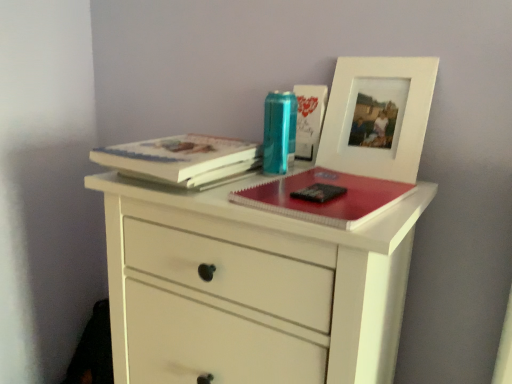
Question: Are hardcover book at upper left, which is the 1th paperback book from left to right, and white matte picture frame at upper right beside each other?

Choices:
 (A) no
 (B) yes

Answer: (A)

Question: Is hardcover book at upper left, which is the 1th paperback book from left to right, oriented away from white matte picture frame at upper right?

Choices:
 (A) yes
 (B) no

Answer: (B)

Question: Considering the relative sizes of hardcover book at upper left, marked as the 2th paperback book in a right-to-left arrangement, and white matte picture frame at upper right in the image provided, is hardcover book at upper left, marked as the 2th paperback book in a right-to-left arrangement, wider than white matte picture frame at upper right?

Choices:
 (A) yes
 (B) no

Answer: (A)

Question: Can you confirm if hardcover book at upper left, which is the 1th paperback book from left to right, is thinner than white matte picture frame at upper right?

Choices:
 (A) yes
 (B) no

Answer: (B)

Question: From the image's perspective, is hardcover book at upper left, marked as the 2th paperback book in a right-to-left arrangement, located beneath white matte picture frame at upper right?

Choices:
 (A) yes
 (B) no

Answer: (A)

Question: Looking at the image, does matte red notebook at center seem bigger or smaller compared to translucent plastic can at center?

Choices:
 (A) big
 (B) small

Answer: (A)

Question: Is point (349, 213) closer or farther from the camera than point (288, 158)?

Choices:
 (A) closer
 (B) farther

Answer: (A)

Question: Considering their positions, is matte red notebook at center located in front of or behind translucent plastic can at center?

Choices:
 (A) front
 (B) behind

Answer: (A)

Question: Is matte red notebook at center inside or outside of translucent plastic can at center?

Choices:
 (A) inside
 (B) outside

Answer: (B)

Question: From a real-world perspective, is translucent plastic can at center physically located above or below white matte picture frame at upper right?

Choices:
 (A) below
 (B) above

Answer: (A)

Question: Choose the correct answer: Is translucent plastic can at center inside white matte picture frame at upper right or outside it?

Choices:
 (A) inside
 (B) outside

Answer: (B)

Question: From the image's perspective, is translucent plastic can at center above or below white matte picture frame at upper right?

Choices:
 (A) above
 (B) below

Answer: (B)

Question: In terms of width, does translucent plastic can at center look wider or thinner when compared to white matte picture frame at upper right?

Choices:
 (A) thin
 (B) wide

Answer: (B)

Question: Do you think white matte picture frame at upper right is within hardcover book at upper left, marked as the 2th paperback book in a right-to-left arrangement, or outside of it?

Choices:
 (A) inside
 (B) outside

Answer: (B)

Question: Does point (359, 152) appear closer or farther from the camera than point (142, 160)?

Choices:
 (A) closer
 (B) farther

Answer: (B)